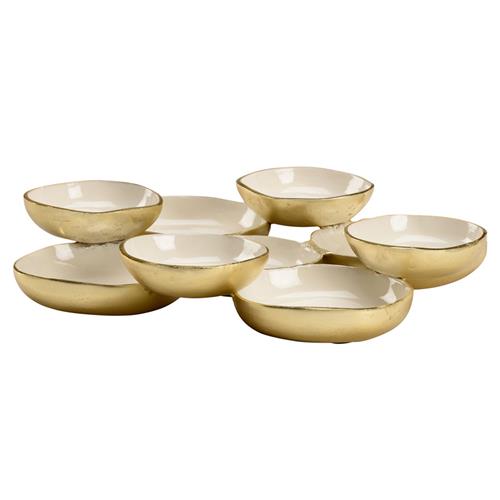
I want to click on bottom bowls, so click(x=294, y=316), click(x=61, y=298), click(x=219, y=220), click(x=283, y=254), click(x=325, y=242).